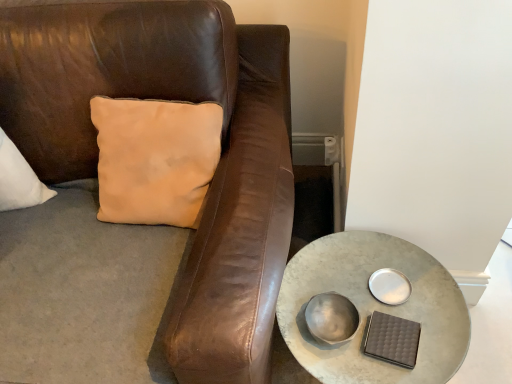
At what (x,y) coordinates should I click in order to perform the action: click on free space above metallic gray table at lower right (from a real-world perspective). Please return your answer as a coordinate pair (x, y). Looking at the image, I should click on (374, 321).